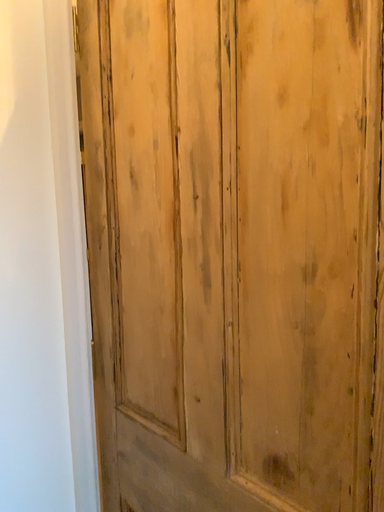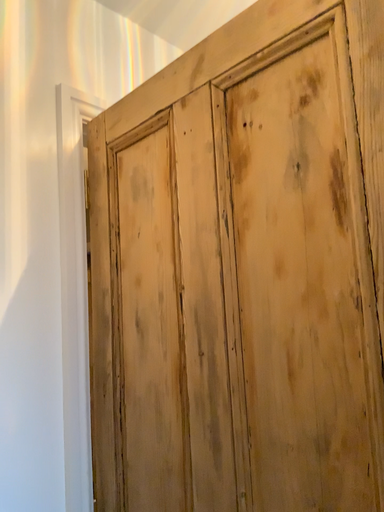
Question: How did the camera likely rotate when shooting the video?

Choices:
 (A) rotated downward
 (B) rotated upward

Answer: (B)